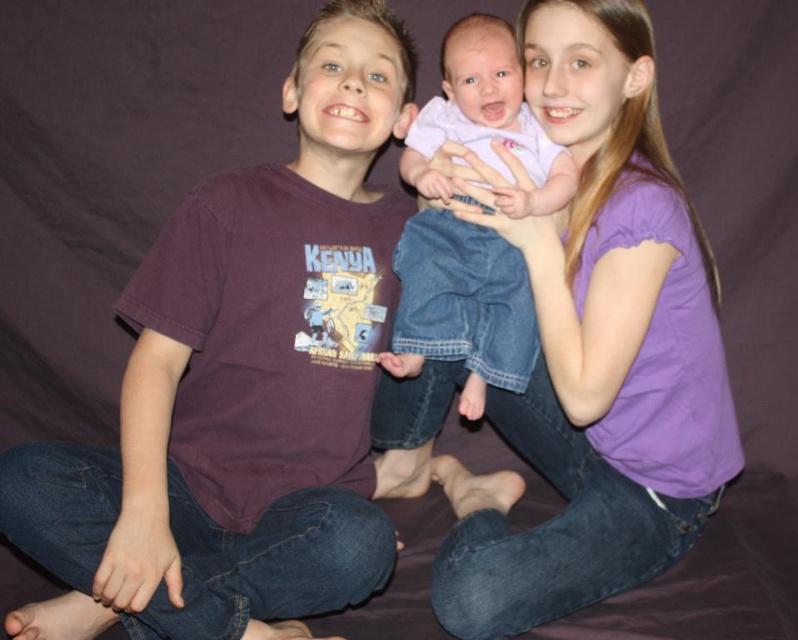
Which of these two, maroon t-shirt at left or pink fabric baby at center, stands shorter?

Standing shorter between the two is pink fabric baby at center.

Which is below, maroon t-shirt at left or pink fabric baby at center?

maroon t-shirt at left is below.

What do you see at coordinates (241, 385) in the screenshot? Image resolution: width=798 pixels, height=640 pixels. I see `maroon t-shirt at left` at bounding box center [241, 385].

Where is `maroon t-shirt at left`? The image size is (798, 640). maroon t-shirt at left is located at coordinates (241, 385).

Between maroon t-shirt at left and purple cotton shirt at center, which one appears on the left side from the viewer's perspective?

maroon t-shirt at left is more to the left.

Is maroon t-shirt at left smaller than purple cotton shirt at center?

Yes.

The width and height of the screenshot is (798, 640). What do you see at coordinates (241, 385) in the screenshot?
I see `maroon t-shirt at left` at bounding box center [241, 385].

Locate an element on the screen. maroon t-shirt at left is located at coordinates (241, 385).

Who is taller, purple cotton shirt at center or pink fabric baby at center?

purple cotton shirt at center is taller.

Can you confirm if purple cotton shirt at center is taller than pink fabric baby at center?

Yes.

This screenshot has height=640, width=798. Identify the location of purple cotton shirt at center. (595, 349).